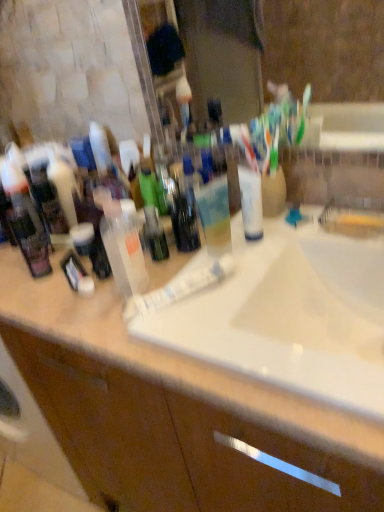
Locate an element on the screen. The width and height of the screenshot is (384, 512). blank space to the left of translucent plastic bottle at center, the 5th toiletry from the left is located at coordinates (63, 300).